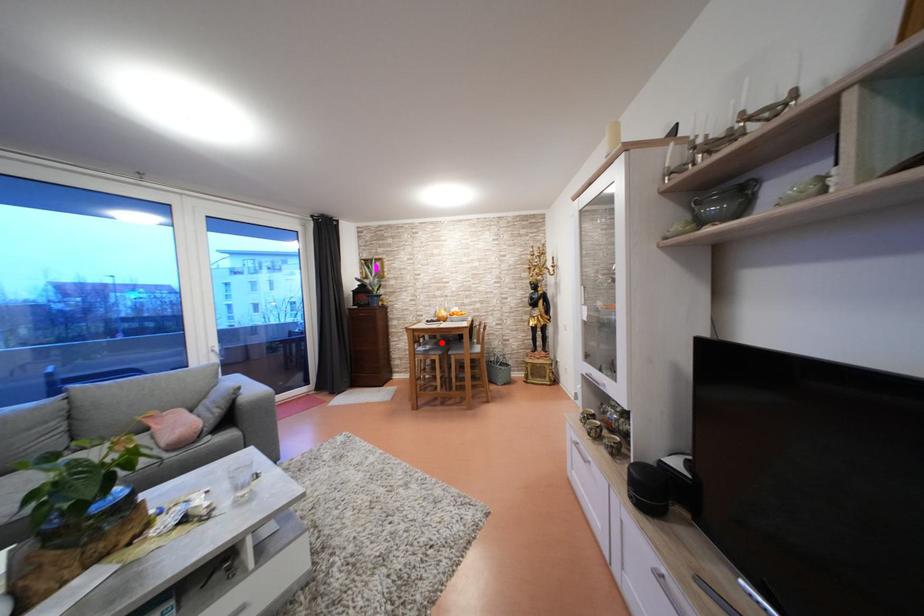
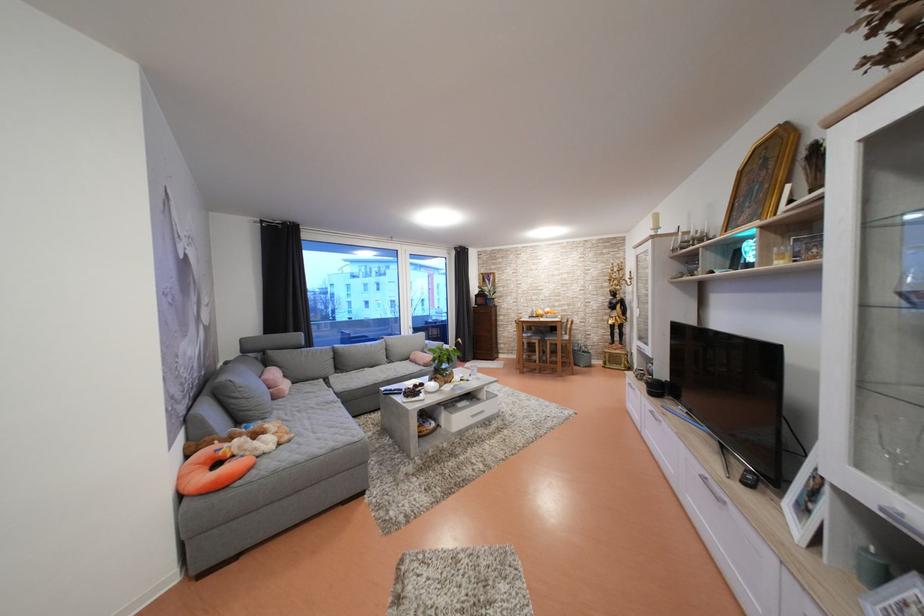
Question: I am providing you with two images of the same scene from different viewpoints. A red point is shown in image1. For the corresponding object point in image2, is it positioned nearer or farther from the camera?

Choices:
 (A) Nearer
 (B) Farther

Answer: (A)